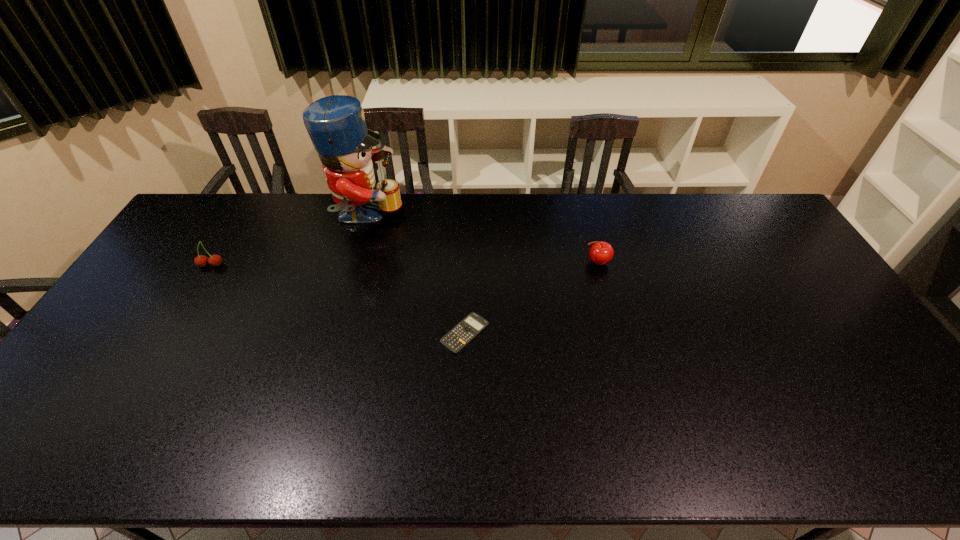
At what (x,y) coordinates should I click in order to perform the action: click on free space that satisfies the following two spatial constraints: 1. on the front-facing side of the farthest object; 2. on the surface of the leftmost object. Please return your answer as a coordinate pair (x, y). Looking at the image, I should click on (353, 265).

In order to click on vacant space that satisfies the following two spatial constraints: 1. on the front-facing side of the third object from left to right; 2. on the left side of the third object from right to left in this screenshot , I will do `click(334, 333)`.

I want to click on vacant space that satisfies the following two spatial constraints: 1. on the front-facing side of the farthest object; 2. on the back side of the right cherry, so click(x=354, y=262).

At what (x,y) coordinates should I click in order to perform the action: click on vacant space that satisfies the following two spatial constraints: 1. on the surface of the left cherry; 2. on the right side of the nearest object. Please return your answer as a coordinate pair (x, y). Looking at the image, I should click on (170, 333).

I want to click on vacant space that satisfies the following two spatial constraints: 1. on the surface of the shortest object; 2. on the left side of the leftmost object, so click(170, 333).

This screenshot has height=540, width=960. Find the location of `free spot that satisfies the following two spatial constraints: 1. on the surface of the left cherry; 2. on the left side of the nearest object`. free spot that satisfies the following two spatial constraints: 1. on the surface of the left cherry; 2. on the left side of the nearest object is located at coordinates (170, 333).

In order to click on free space that satisfies the following two spatial constraints: 1. on the front-facing side of the nutcracker; 2. on the back side of the shortest object in this screenshot , I will do `click(334, 333)`.